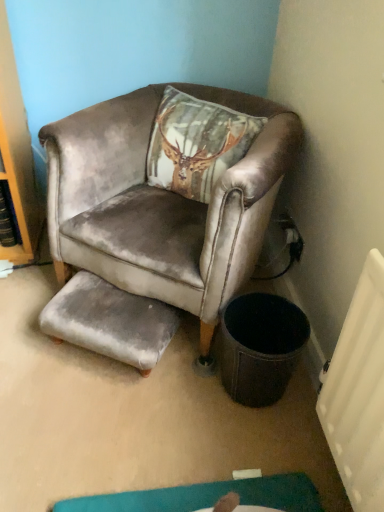
Image resolution: width=384 pixels, height=512 pixels. What do you see at coordinates (160, 212) in the screenshot?
I see `velvet brown armchair at upper center` at bounding box center [160, 212].

Identify the location of velvet brown armchair at upper center. (160, 212).

Describe the element at coordinates (110, 321) in the screenshot. The image size is (384, 512). I see `gray velvet footrest at lower center` at that location.

Locate an element on the screen. The image size is (384, 512). gray velvet footrest at lower center is located at coordinates (110, 321).

This screenshot has height=512, width=384. I want to click on velvet brown armchair at upper center, so click(x=160, y=212).

Considering the relative positions of gray velvet footrest at lower center and velvet brown armchair at upper center in the image provided, is gray velvet footrest at lower center to the right of velvet brown armchair at upper center from the viewer's perspective?

In fact, gray velvet footrest at lower center is to the left of velvet brown armchair at upper center.

Does gray velvet footrest at lower center lie in front of velvet brown armchair at upper center?

No, it is behind velvet brown armchair at upper center.

Does point (59, 295) come in front of point (207, 161)?

Yes, it is.

From the image's perspective, is gray velvet footrest at lower center on velvet brown armchair at upper center?

Incorrect, from the image's perspective, gray velvet footrest at lower center is lower than velvet brown armchair at upper center.

Consider the image. From a real-world perspective, is gray velvet footrest at lower center located beneath velvet brown armchair at upper center?

Yes, from a real-world perspective, gray velvet footrest at lower center is beneath velvet brown armchair at upper center.

Is gray velvet footrest at lower center thinner than velvet brown armchair at upper center?

Indeed, gray velvet footrest at lower center has a lesser width compared to velvet brown armchair at upper center.

Which of these two, gray velvet footrest at lower center or velvet brown armchair at upper center, stands shorter?

Standing shorter between the two is gray velvet footrest at lower center.

Who is bigger, gray velvet footrest at lower center or velvet brown armchair at upper center?

velvet brown armchair at upper center.

Would you say gray velvet footrest at lower center is inside or outside velvet brown armchair at upper center?

gray velvet footrest at lower center can be found inside velvet brown armchair at upper center.

In the scene shown: Can you see gray velvet footrest at lower center touching velvet brown armchair at upper center?

There is a gap between gray velvet footrest at lower center and velvet brown armchair at upper center.

Is gray velvet footrest at lower center facing towards velvet brown armchair at upper center?

No, gray velvet footrest at lower center is not oriented towards velvet brown armchair at upper center.

How different are the orientations of gray velvet footrest at lower center and velvet brown armchair at upper center in degrees?

The angular difference between gray velvet footrest at lower center and velvet brown armchair at upper center is 6.22 degrees.

Measure the distance between gray velvet footrest at lower center and velvet brown armchair at upper center.

gray velvet footrest at lower center and velvet brown armchair at upper center are 21.88 centimeters apart.

This screenshot has height=512, width=384. There is a gray velvet footrest at lower center. Find the location of `chair above it (from a real-world perspective)`. chair above it (from a real-world perspective) is located at coordinates (160, 212).

Considering the relative positions of velvet brown armchair at upper center and gray velvet footrest at lower center in the image provided, is velvet brown armchair at upper center to the left of gray velvet footrest at lower center from the viewer's perspective?

No.

Considering the relative positions of velvet brown armchair at upper center and gray velvet footrest at lower center in the image provided, is velvet brown armchair at upper center behind gray velvet footrest at lower center?

That is False.

Does point (223, 172) appear closer or farther from the camera than point (158, 354)?

Point (223, 172).

From the image's perspective, between velvet brown armchair at upper center and gray velvet footrest at lower center, who is located below?

gray velvet footrest at lower center appears lower in the image.

From a real-world perspective, does velvet brown armchair at upper center sit lower than gray velvet footrest at lower center?

No, from a real-world perspective, velvet brown armchair at upper center is not below gray velvet footrest at lower center.

Between velvet brown armchair at upper center and gray velvet footrest at lower center, which one has larger width?

Wider between the two is velvet brown armchair at upper center.

Is velvet brown armchair at upper center shorter than gray velvet footrest at lower center?

In fact, velvet brown armchair at upper center may be taller than gray velvet footrest at lower center.

Based on their sizes in the image, would you say velvet brown armchair at upper center is bigger or smaller than gray velvet footrest at lower center?

In the image, velvet brown armchair at upper center appears to be larger than gray velvet footrest at lower center.

Is velvet brown armchair at upper center spatially inside gray velvet footrest at lower center, or outside of it?

velvet brown armchair at upper center is not inside gray velvet footrest at lower center, it's outside.

Is velvet brown armchair at upper center touching gray velvet footrest at lower center?

velvet brown armchair at upper center is not next to gray velvet footrest at lower center, and they're not touching.

Is velvet brown armchair at upper center facing towards gray velvet footrest at lower center?

Yes, velvet brown armchair at upper center faces towards gray velvet footrest at lower center.

The width and height of the screenshot is (384, 512). In order to click on the footrest behind the velvet brown armchair at upper center in this screenshot , I will do `click(110, 321)`.

Locate an element on the screen. chair that appears above the gray velvet footrest at lower center (from the image's perspective) is located at coordinates (160, 212).

Locate an element on the screen. footrest below the velvet brown armchair at upper center (from a real-world perspective) is located at coordinates (110, 321).